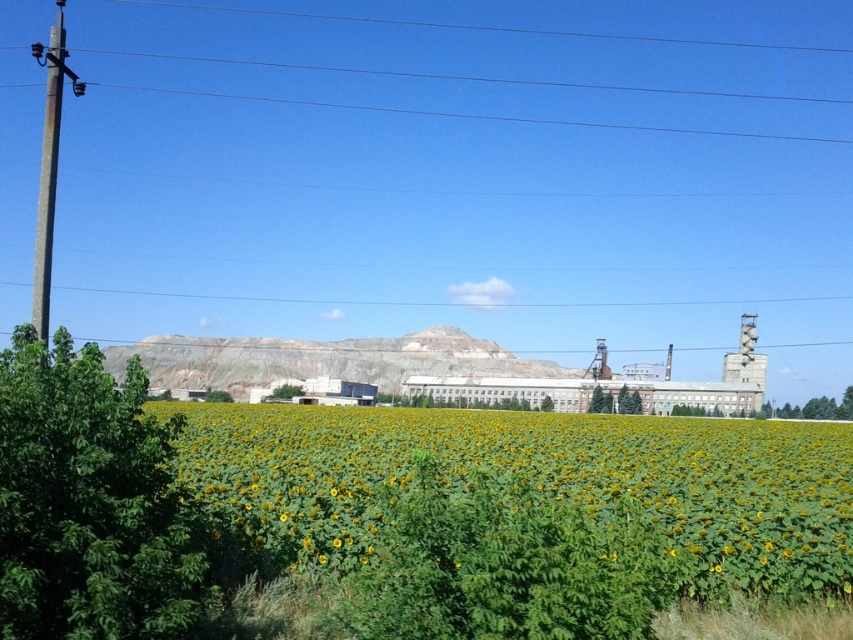
Who is more distant from viewer, (x=366, y=554) or (x=67, y=67)?

Point (x=67, y=67)

Between point (810, 472) and point (61, 60), which one is positioned behind?

The point (810, 472) is more distant.

Locate an element on the screen. The height and width of the screenshot is (640, 853). yellow-green leafy field at center is located at coordinates (532, 483).